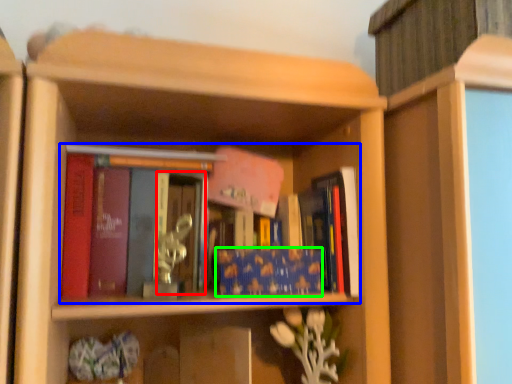
Question: Estimate the real-world distances between objects in this image. Which object is farther from glass door (highlighted by a red box), book (highlighted by a blue box) or book (highlighted by a green box)?

Choices:
 (A) book
 (B) book

Answer: (B)